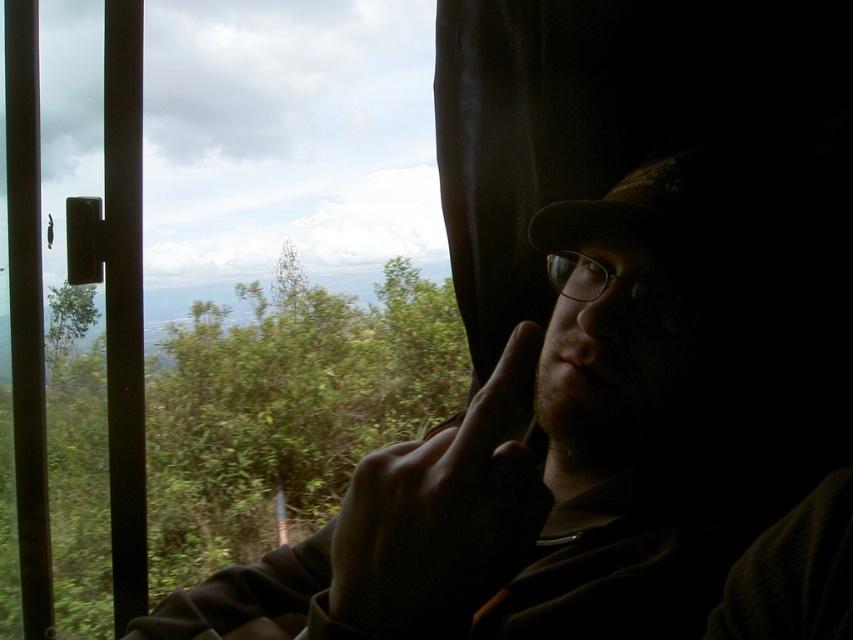
Question: Can you confirm if transparent glass window at upper left is wider than dark skin finger at center?

Choices:
 (A) yes
 (B) no

Answer: (A)

Question: Which of the following is the farthest from the observer?

Choices:
 (A) dark skin finger at center
 (B) transparent glass window at upper left

Answer: (B)

Question: Among these objects, which one is farthest from the camera?

Choices:
 (A) dark skin finger at center
 (B) transparent glass window at upper left

Answer: (B)

Question: Is transparent glass window at upper left in front of dark skin finger at center?

Choices:
 (A) no
 (B) yes

Answer: (A)

Question: Can you confirm if transparent glass window at upper left is positioned to the right of dark skin finger at center?

Choices:
 (A) no
 (B) yes

Answer: (A)

Question: Which object is closer to the camera taking this photo?

Choices:
 (A) transparent glass window at upper left
 (B) dark skin finger at center

Answer: (B)